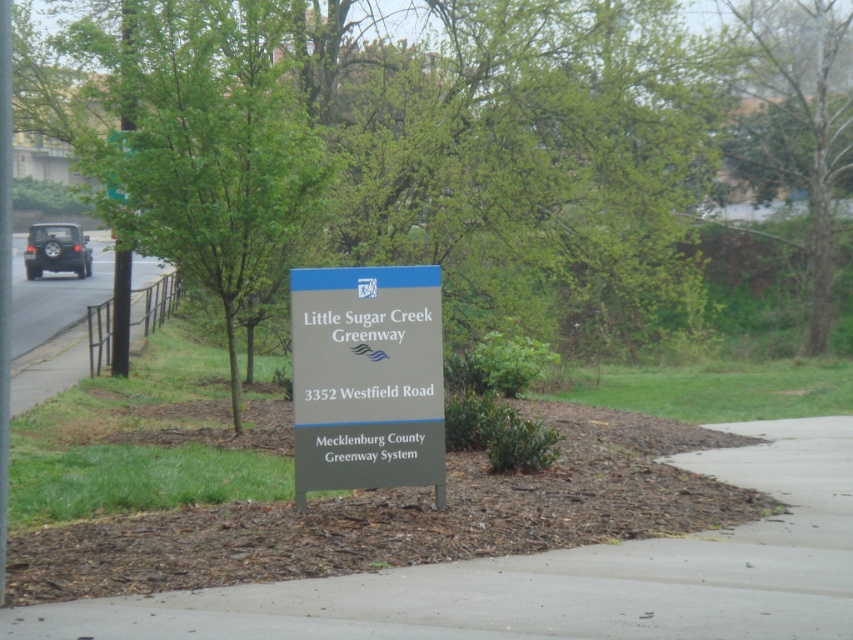
You are a hiker wanting to take a photo of the metallic gray sign at center and the green leafy tree at upper right. From your current position, which object is closer to you?

The metallic gray sign at center is closer to you because it is positioned under the green leafy tree at upper right, meaning the tree is behind the sign.

You are a delivery driver needing to park your 2.5 meter wide truck. You see the gray concrete pavement at center and the green leafy tree at upper right. Which area can accommodate your truck?

The gray concrete pavement at center can accommodate the truck since its width surpasses the green leafy tree at upper right, which is narrower and likely not a paved area suitable for parking.

You are standing at the signboard for Little Sugar Creek Greenway. Which direction should you look to see the green leafy tree at upper right?

The green leafy tree at upper right is located at point (796, 122), which is in the upper right direction from your position at the signboard. Look towards the upper right direction to see it.